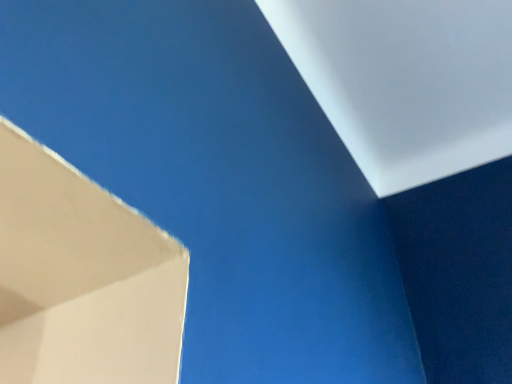
What is the approximate width of white glossy exhaust hood at upper right?

The width of white glossy exhaust hood at upper right is 35.26 inches.

The image size is (512, 384). In order to click on white glossy exhaust hood at upper right in this screenshot , I will do `click(406, 81)`.

In order to face white glossy exhaust hood at upper right, should I rotate leftwards or rightwards?

Turn right approximately 21.256 degrees to face it.

The height and width of the screenshot is (384, 512). Describe the element at coordinates (406, 81) in the screenshot. I see `white glossy exhaust hood at upper right` at that location.

You are a GUI agent. You are given a task and a screenshot of the screen. Output one action in this format:
    pyautogui.click(x=<x>, y=<y>)
    Task: Click on the white glossy exhaust hood at upper right
    Image resolution: width=512 pixels, height=384 pixels.
    Given the screenshot: What is the action you would take?
    pyautogui.click(x=406, y=81)